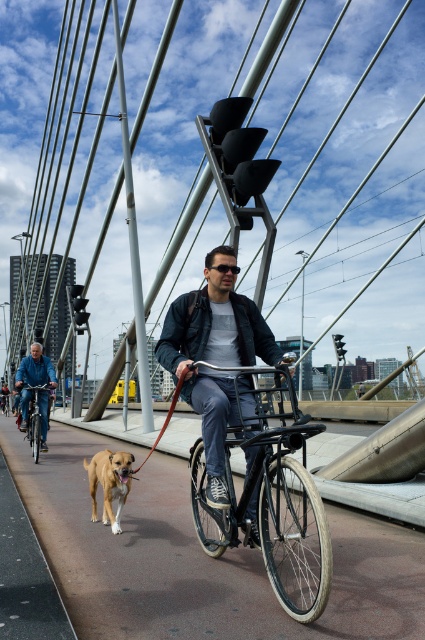
Question: Estimate the real-world distances between objects in this image. Which object is farther from the black matte bicycle at center?

Choices:
 (A) brown leather leash at center
 (B) shiny silver bicycle at left
 (C) golden fur dog at lower left
 (D) smooth asphalt bike lane at center

Answer: (B)

Question: Can you confirm if smooth asphalt bike lane at center is positioned to the right of golden fur dog at lower left?

Choices:
 (A) no
 (B) yes

Answer: (B)

Question: From the image, what is the correct spatial relationship of matte black jacket at center in relation to shiny silver bicycle at left?

Choices:
 (A) below
 (B) above

Answer: (B)

Question: Which object appears closest to the camera in this image?

Choices:
 (A) shiny silver bicycle at left
 (B) brown leather leash at center
 (C) matte black jacket at center

Answer: (B)

Question: In this image, where is black matte bicycle at center located relative to brown leather leash at center?

Choices:
 (A) above
 (B) below

Answer: (A)

Question: Which point is farther from the camera taking this photo?

Choices:
 (A) (146, 458)
 (B) (241, 294)
 (C) (190, 550)
 (D) (36, 401)

Answer: (D)